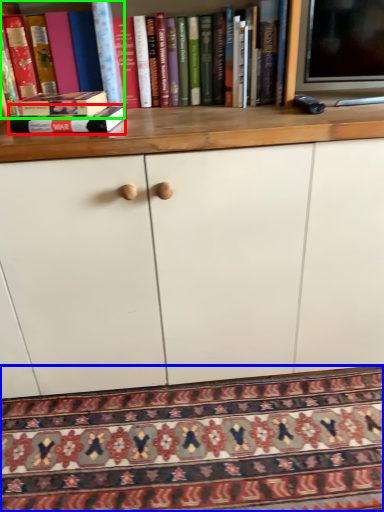
Question: Considering the real-world distances, which object is farthest from book (highlighted by a red box)? mat (highlighted by a blue box) or book (highlighted by a green box)?

Choices:
 (A) mat
 (B) book

Answer: (A)